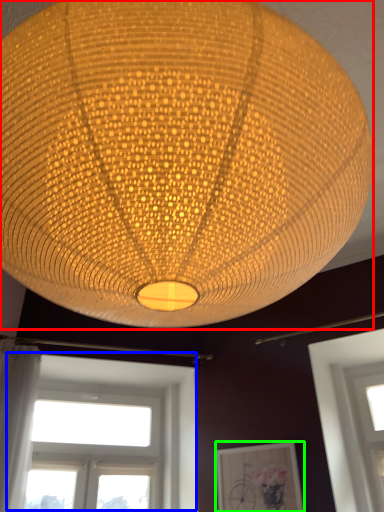
Question: Which is farther away from lamp (highlighted by a red box)? window (highlighted by a blue box) or picture frame (highlighted by a green box)?

Choices:
 (A) window
 (B) picture frame

Answer: (A)